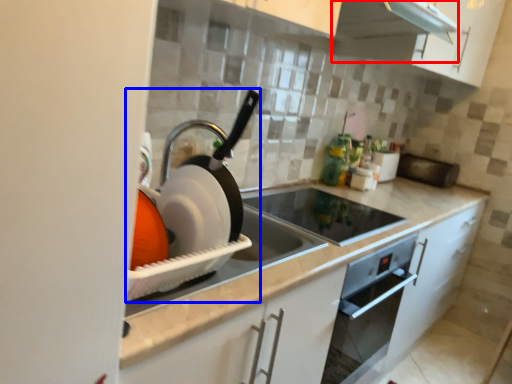
Question: Which point is further to the camera, exhaust hood (highlighted by a red box) or appliance (highlighted by a blue box)?

Choices:
 (A) exhaust hood
 (B) appliance

Answer: (A)